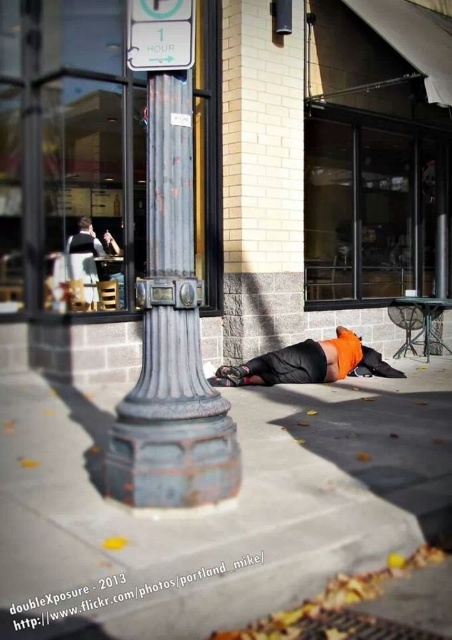
Question: Which point is closer to the camera?

Choices:
 (A) rusty metal pole at center
 (B) orange fabric at lower center
 (C) brick wall at center

Answer: (A)

Question: Among these points, which one is farthest from the camera?

Choices:
 (A) (358, 232)
 (B) (186, 92)
 (C) (277, 378)
 (D) (60, 433)

Answer: (A)

Question: Is the position of gray concrete sidewalk at lower center more distant than that of white plastic sign at upper center?

Choices:
 (A) yes
 (B) no

Answer: (B)

Question: Is brick wall at center positioned behind rusty metal pole at center?

Choices:
 (A) no
 (B) yes

Answer: (B)

Question: Does rusty metal pole at center have a smaller size compared to white plastic sign at upper center?

Choices:
 (A) yes
 (B) no

Answer: (B)

Question: Which object appears farthest from the camera in this image?

Choices:
 (A) gray concrete sidewalk at lower center
 (B) white plastic sign at upper center
 (C) orange fabric at lower center

Answer: (C)